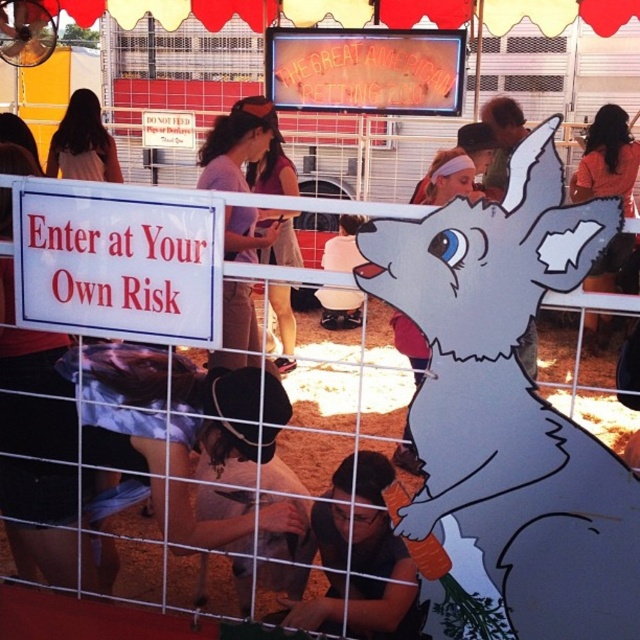
Is point (332, 628) behind point (275, 554)?

That is False.

Does dark brown hair at lower center have a lesser height compared to soft gray fur at center?

Yes.

Does point (339, 477) lie in front of point (266, 474)?

Yes, it is.

Where is `dark brown hair at lower center`? dark brown hair at lower center is located at coordinates (360, 560).

Is soft gray fur at center positioned before blonde hair at upper left?

Yes, soft gray fur at center is closer to the viewer.

Is soft gray fur at center smaller than blonde hair at upper left?

No, soft gray fur at center is not smaller than blonde hair at upper left.

Is point (243, 465) positioned in front of point (84, 147)?

That is True.

Find the location of `soft gray fur at center`. soft gray fur at center is located at coordinates (252, 508).

Which is more to the left, purple fabric shirt at center or matte white rabbit at center?

purple fabric shirt at center

Who is more forward, (228, 342) or (355, 253)?

Point (228, 342) is more forward.

What are the coordinates of `purple fabric shirt at center` in the screenshot? It's located at (236, 145).